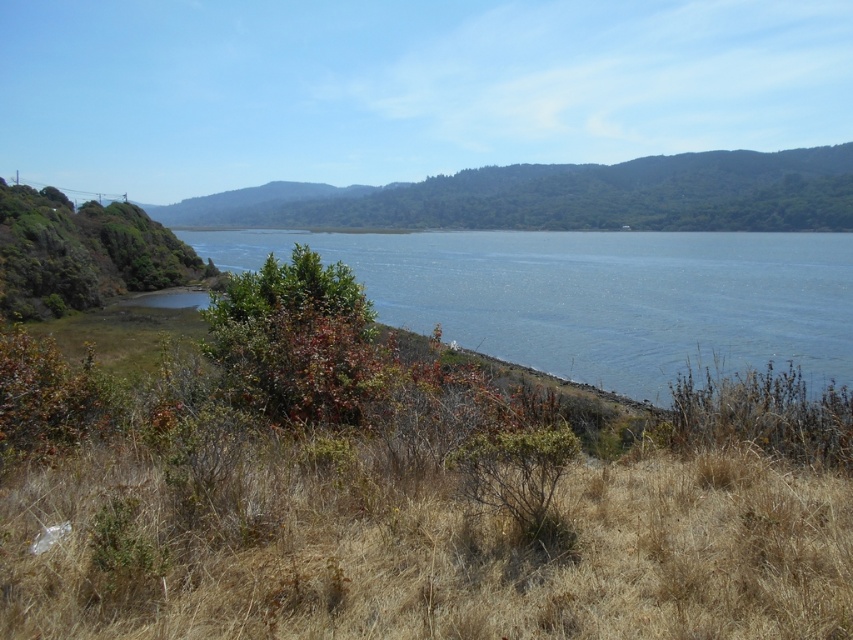
Question: Which point is closer to the camera taking this photo?

Choices:
 (A) [708, 332]
 (B) [305, 634]
 (C) [822, 180]

Answer: (B)

Question: Is dry grass at lower left further to camera compared to green leafy hillside at center?

Choices:
 (A) no
 (B) yes

Answer: (A)

Question: Which object is positioned farthest from the blue water at center?

Choices:
 (A) dry grass at lower left
 (B) green leafy hillside at center

Answer: (B)

Question: Which point is farther from the camera taking this photo?

Choices:
 (A) (529, 580)
 (B) (659, 358)
 (C) (641, 220)

Answer: (C)

Question: Is dry grass at lower left bigger than blue water at center?

Choices:
 (A) no
 (B) yes

Answer: (A)

Question: Is dry grass at lower left positioned in front of blue water at center?

Choices:
 (A) yes
 (B) no

Answer: (A)